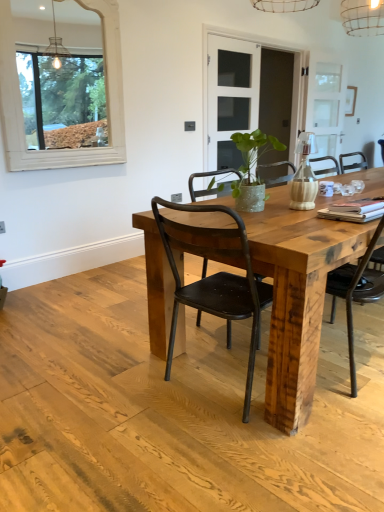
I want to click on free spot to the right of green textured vase at center, so click(x=291, y=209).